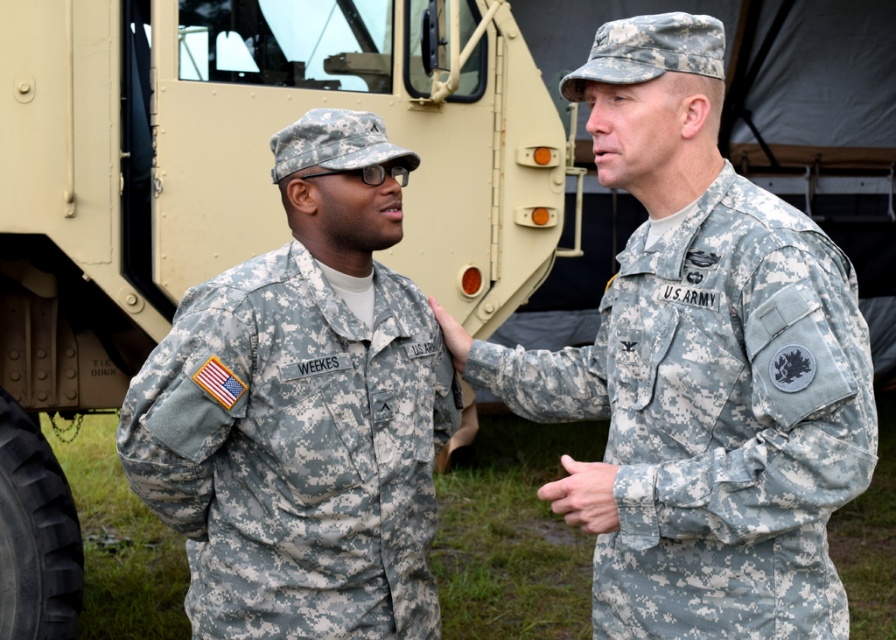
Question: Is tan matte truck at upper left in front of camouflage fabric uniform at left?

Choices:
 (A) yes
 (B) no

Answer: (B)

Question: Among these points, which one is nearest to the camera?

Choices:
 (A) (181, 20)
 (B) (836, 420)

Answer: (B)

Question: Can you confirm if tan matte truck at upper left is positioned below camouflage fabric uniform at left?

Choices:
 (A) yes
 (B) no

Answer: (B)

Question: Which point is farther from the camera taking this photo?

Choices:
 (A) (156, 413)
 (B) (1, 44)

Answer: (B)

Question: Does tan matte truck at upper left appear on the right side of camouflage fabric us army uniform at right?

Choices:
 (A) no
 (B) yes

Answer: (A)

Question: Which of the following is the closest to the observer?

Choices:
 (A) (851, 269)
 (B) (130, 422)
 (C) (145, 349)

Answer: (A)